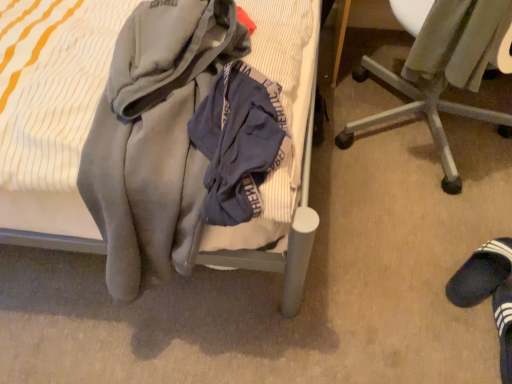
Question: Does soft gray blanket at center appear on the right side of black suede slipper at lower right?

Choices:
 (A) yes
 (B) no

Answer: (B)

Question: Can you confirm if soft gray blanket at center is wider than black suede slipper at lower right?

Choices:
 (A) yes
 (B) no

Answer: (A)

Question: From a real-world perspective, is soft gray blanket at center located higher than black suede slipper at lower right?

Choices:
 (A) no
 (B) yes

Answer: (B)

Question: From a real-world perspective, is soft gray blanket at center under black suede slipper at lower right?

Choices:
 (A) no
 (B) yes

Answer: (A)

Question: Is soft gray blanket at center located outside black suede slipper at lower right?

Choices:
 (A) yes
 (B) no

Answer: (A)

Question: Are soft gray blanket at center and black suede slipper at lower right making contact?

Choices:
 (A) no
 (B) yes

Answer: (A)

Question: Is velvet-like gray sweater at lower right wider than black suede slipper at lower right?

Choices:
 (A) no
 (B) yes

Answer: (A)

Question: Considering the relative positions of velvet-like gray sweater at lower right and black suede slipper at lower right in the image provided, is velvet-like gray sweater at lower right to the left of black suede slipper at lower right from the viewer's perspective?

Choices:
 (A) no
 (B) yes

Answer: (B)

Question: Considering the relative sizes of velvet-like gray sweater at lower right and black suede slipper at lower right in the image provided, is velvet-like gray sweater at lower right thinner than black suede slipper at lower right?

Choices:
 (A) yes
 (B) no

Answer: (A)

Question: Considering the relative sizes of velvet-like gray sweater at lower right and black suede slipper at lower right in the image provided, is velvet-like gray sweater at lower right bigger than black suede slipper at lower right?

Choices:
 (A) yes
 (B) no

Answer: (A)

Question: Considering the relative sizes of velvet-like gray sweater at lower right and black suede slipper at lower right in the image provided, is velvet-like gray sweater at lower right taller than black suede slipper at lower right?

Choices:
 (A) yes
 (B) no

Answer: (A)

Question: Can you confirm if velvet-like gray sweater at lower right is shorter than black suede slipper at lower right?

Choices:
 (A) yes
 (B) no

Answer: (B)

Question: Is the position of metallic silver chair at lower right less distant than that of black suede slipper at lower right?

Choices:
 (A) no
 (B) yes

Answer: (B)